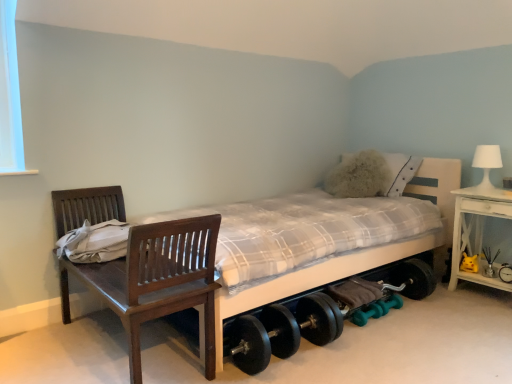
Where is `free space in front of green rubber dumbbell at lower center, the 2th dumbbell in the left-to-right sequence`? free space in front of green rubber dumbbell at lower center, the 2th dumbbell in the left-to-right sequence is located at coordinates (400, 326).